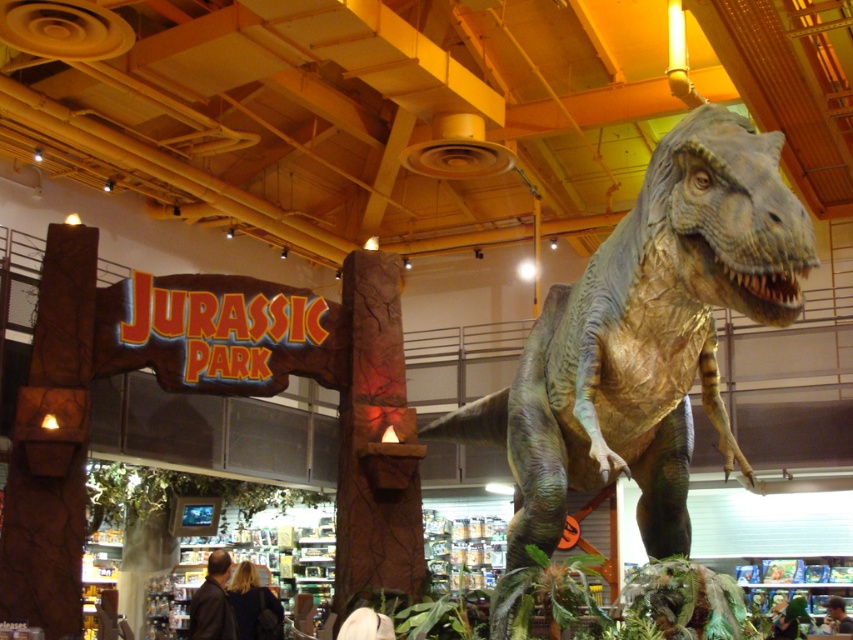
Is point (643, 218) positioned before point (381, 292)?

Yes, it is in front of point (381, 292).

Does green textured dinosaur at center come in front of brown cracked stone at center?

Yes, it is.

You are a GUI agent. You are given a task and a screenshot of the screen. Output one action in this format:
    pyautogui.click(x=<x>, y=<y>)
    Task: Click on the green textured dinosaur at center
    
    Given the screenshot: What is the action you would take?
    pyautogui.click(x=646, y=336)